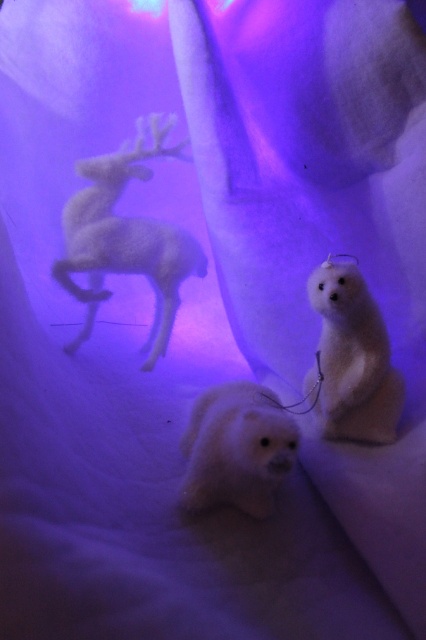
Does point (379, 417) come behind point (247, 461)?

Yes, it is behind point (247, 461).

Who is positioned more to the left, white fluffy polar bear at center or white plush polar bear at center?

Positioned to the left is white plush polar bear at center.

Describe the element at coordinates (353, 358) in the screenshot. I see `white fluffy polar bear at center` at that location.

Locate an element on the screen. white fluffy polar bear at center is located at coordinates (x=353, y=358).